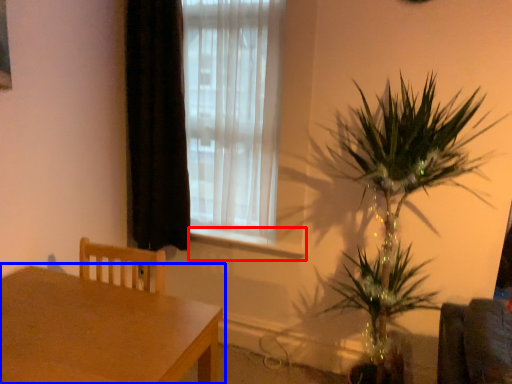
Question: Which object appears farthest to the camera in this image, window sill (highlighted by a red box) or table (highlighted by a blue box)?

Choices:
 (A) window sill
 (B) table

Answer: (A)